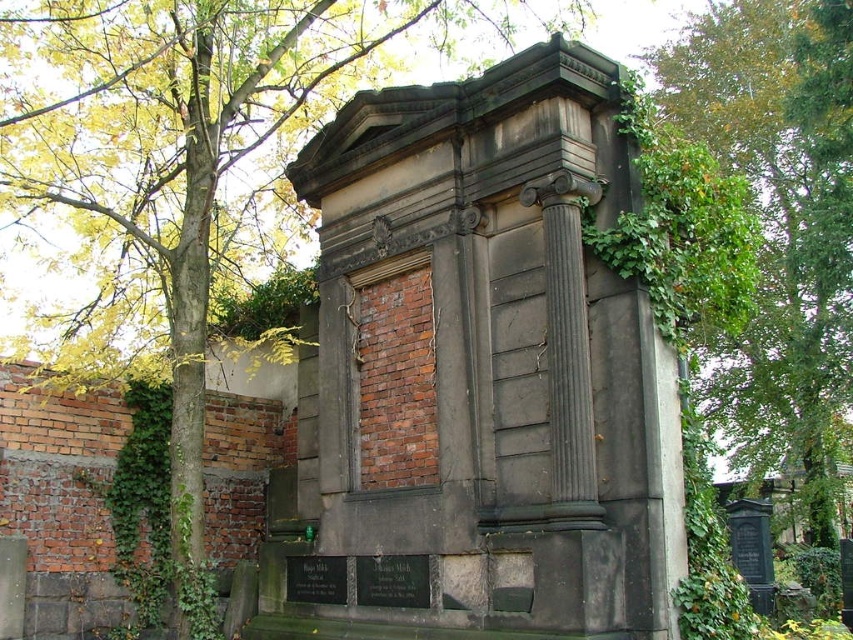
Is dark gray stone monument at center closer to camera compared to green leafy tree at upper center?

Yes, it is in front of green leafy tree at upper center.

Measure the distance between point (413,541) and camera.

Point (413,541) and camera are 20.25 meters apart.

Where is `dark gray stone monument at center`? This screenshot has width=853, height=640. dark gray stone monument at center is located at coordinates (480, 372).

Is green leafy tree at upper center thinner than green leafy tree at upper right?

No.

Can you confirm if green leafy tree at upper center is positioned below green leafy tree at upper right?

No, green leafy tree at upper center is not below green leafy tree at upper right.

Locate an element on the screen. green leafy tree at upper center is located at coordinates [x=171, y=163].

Which is behind, point (618, 369) or point (849, 362)?

The point (849, 362) is more distant.

I want to click on dark gray stone monument at center, so click(x=480, y=372).